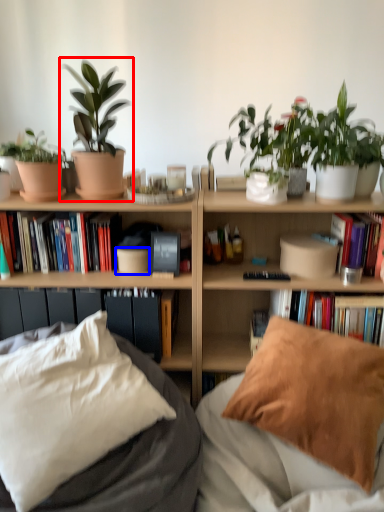
Question: Which point is closer to the camera, houseplant (highlighted by a red box) or flowerpot (highlighted by a blue box)?

Choices:
 (A) houseplant
 (B) flowerpot

Answer: (A)